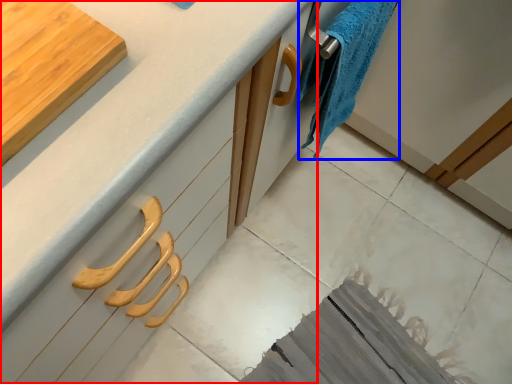
Question: Which object is closer to the camera taking this photo, countertop (highlighted by a red box) or bath towel (highlighted by a blue box)?

Choices:
 (A) countertop
 (B) bath towel

Answer: (A)